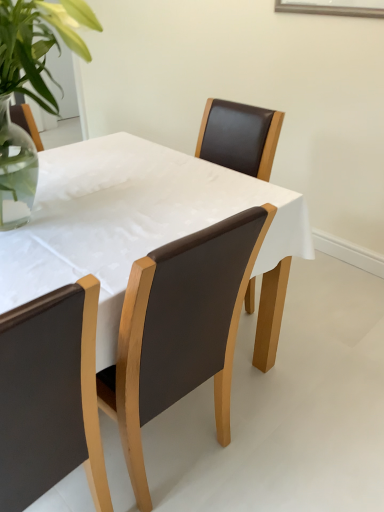
Locate an element on the screen. The height and width of the screenshot is (512, 384). blank space situated above matte brown table at center (from a real-world perspective) is located at coordinates (124, 199).